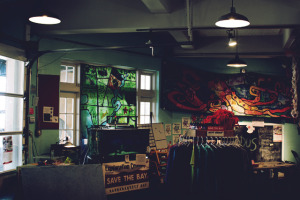
Where is `lights`? This screenshot has width=300, height=200. lights is located at coordinates (x=228, y=21), (x=232, y=44), (x=232, y=65), (x=52, y=18).